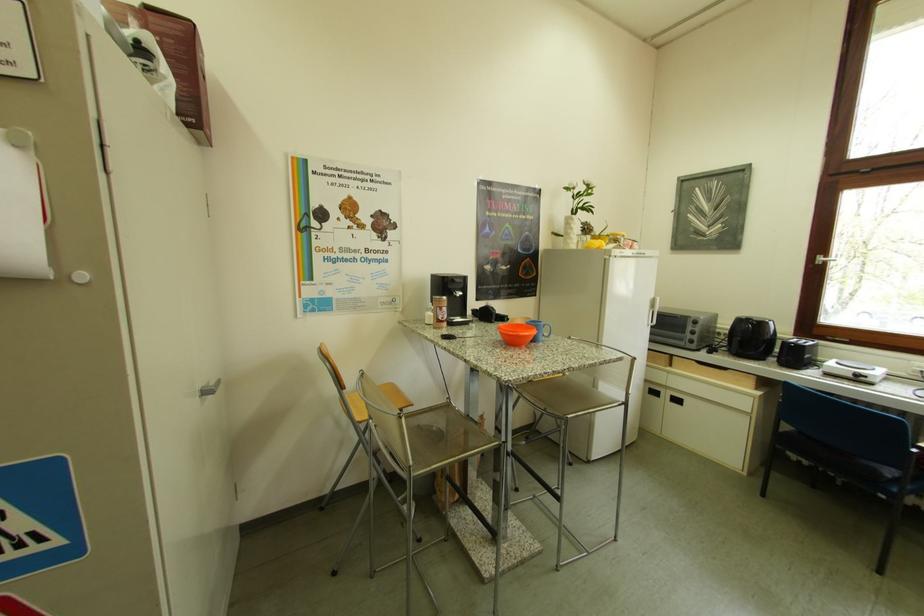
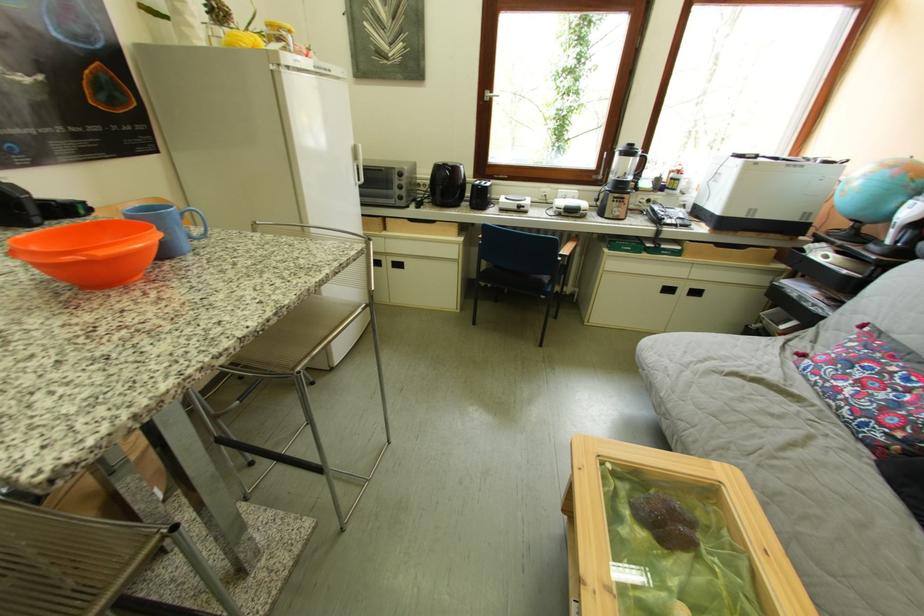
How did the camera likely rotate?

The camera's rotation is toward right-down.